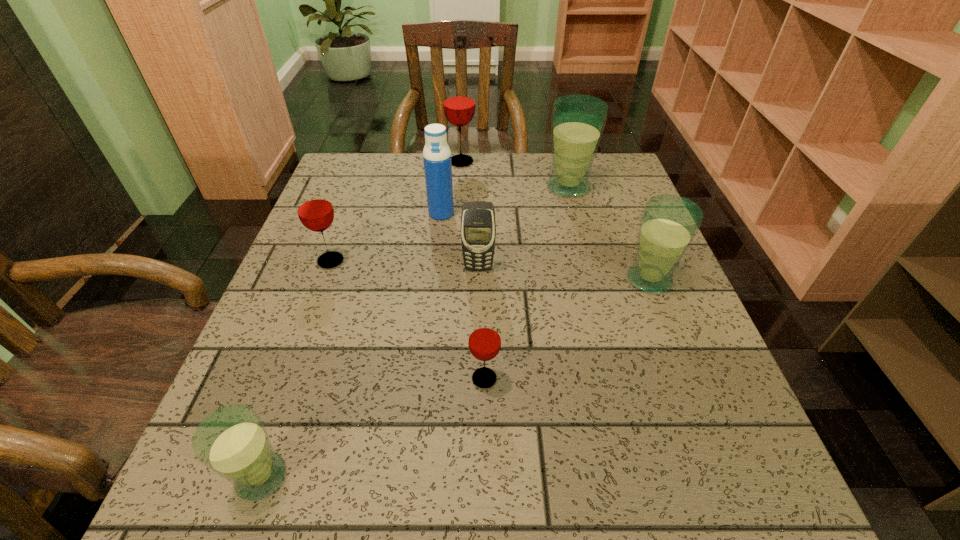
This screenshot has height=540, width=960. I want to click on free space located 0.260m on the front face of the cellular telephone, so click(478, 376).

At what (x,y) coordinates should I click in order to perform the action: click on vacant space positioned on the left of the seventh farthest object. Please return your answer as a coordinate pair (x, y). This screenshot has height=540, width=960. Looking at the image, I should click on (271, 379).

What are the coordinates of `free space located 0.150m on the right of the leftmost blue glass` in the screenshot? It's located at (393, 477).

Where is `object located at the near edge`? Image resolution: width=960 pixels, height=540 pixels. object located at the near edge is located at coordinates (232, 441).

Find the location of a particular element. object located at the near left corner is located at coordinates (232, 441).

This screenshot has height=540, width=960. In order to click on object that is at the far right corner in this screenshot , I will do `click(577, 121)`.

Where is `vacant space at the far edge of the desktop`? This screenshot has width=960, height=540. vacant space at the far edge of the desktop is located at coordinates (504, 157).

The height and width of the screenshot is (540, 960). I want to click on vacant space at the left edge of the desktop, so click(x=326, y=328).

The image size is (960, 540). I want to click on vacant area at the right edge, so click(676, 323).

Find the location of a particular element. free space at the far left corner of the desktop is located at coordinates (362, 169).